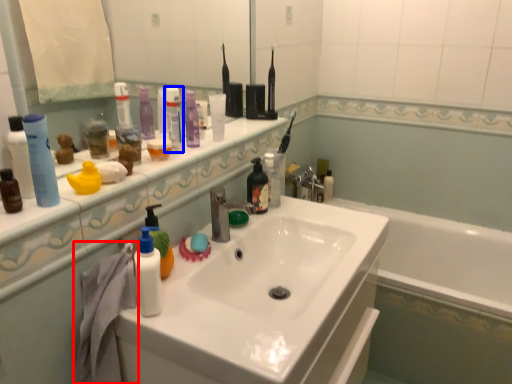
Question: Which object is further to the camera taking this photo, bath towel (highlighted by a red box) or mouthwash (highlighted by a blue box)?

Choices:
 (A) bath towel
 (B) mouthwash

Answer: (B)